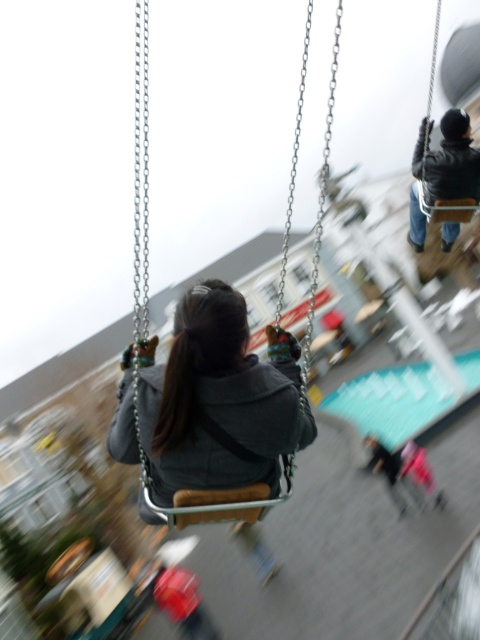
You are standing at the back of the wooden swing at center and want to wave to the person in the dark gray jacket at upper right. Which direction should you turn your head to face them?

The wooden swing at center is to the right of the dark gray jacket at upper right. Therefore, to face the person in the dark gray jacket at upper right, you should turn your head to the left.

You are standing at the entrance of the playground and see two people swinging. One is wearing a dark gray hoodie at center and the other a dark gray jacket at upper right. Which one appears closer to you?

The dark gray hoodie at center appears closer because it is positioned below the dark gray jacket at upper right, indicating it is nearer in the scene.

You are standing behind the wooden swing at center and want to see the dark gray jacket at upper right. Can you see it clearly without moving your head?

The wooden swing at center is in front of the dark gray jacket at upper right, so it might block your view. Move your head slightly to the side to see the dark gray jacket at upper right.